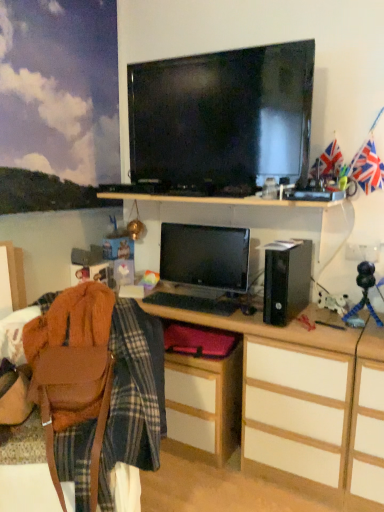
At what (x,y) coordinates should I click in order to perform the action: click on vacant space in front of black plastic speaker at right. Please return your answer as a coordinate pair (x, y). This screenshot has height=512, width=384. Looking at the image, I should click on (320, 327).